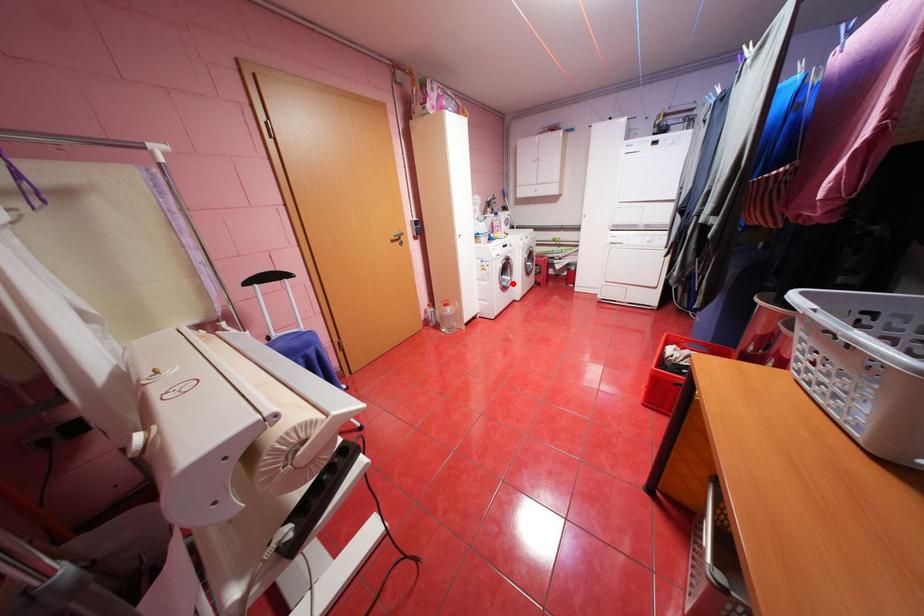
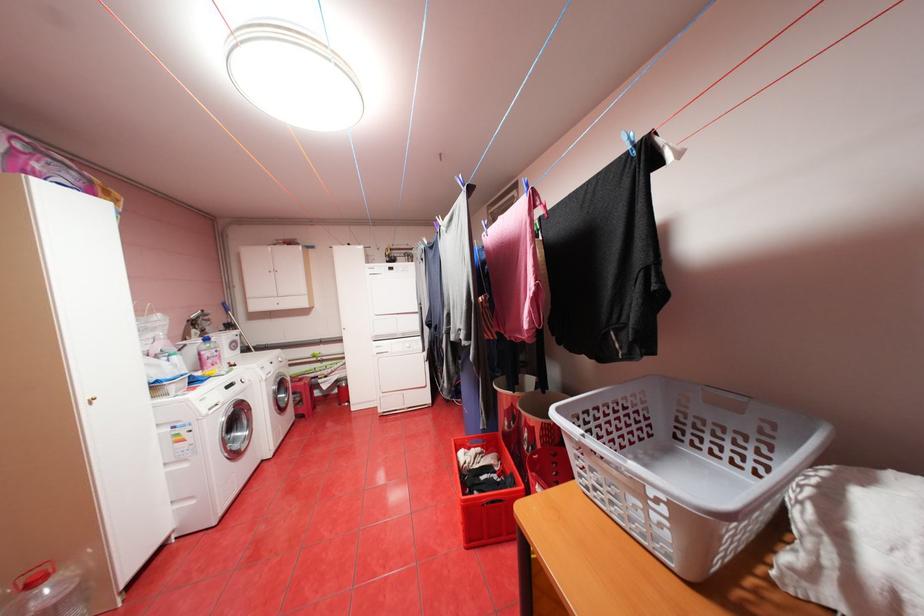
Question: I am providing you with two images of the same scene from different viewpoints. A red point is shown in image1. For the corresponding object point in image2, is it positioned nearer or farther from the camera?

Choices:
 (A) Nearer
 (B) Farther

Answer: (A)